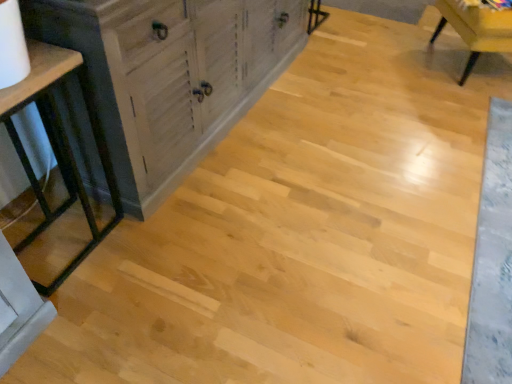
In order to click on free point below matte black table at left (from a real-world perspective) in this screenshot , I will do `click(60, 237)`.